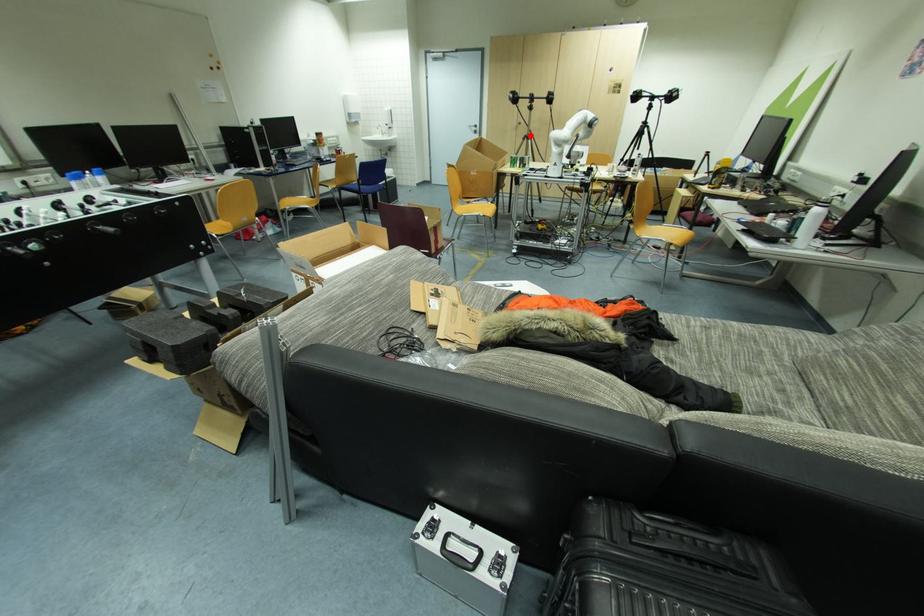
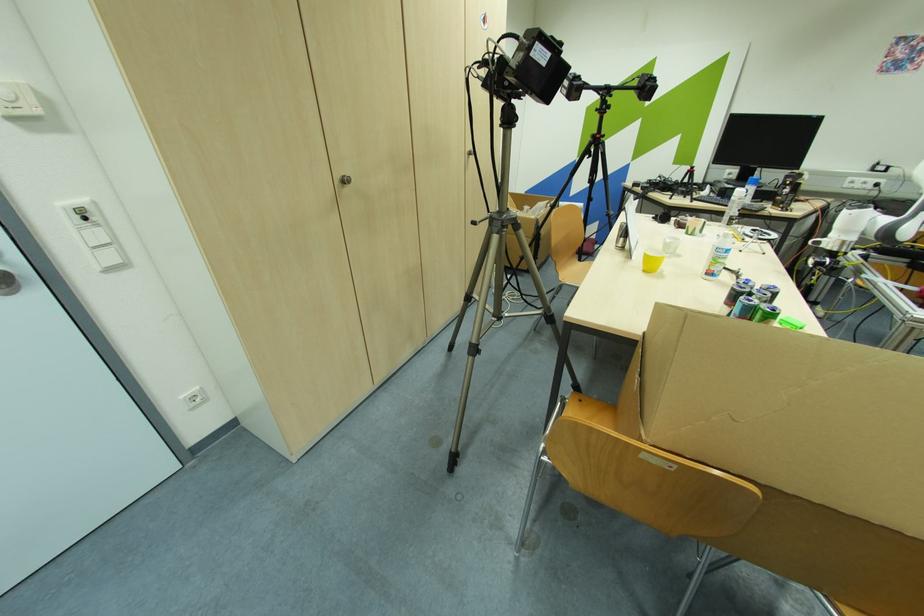
The point at the highlighted location is marked in the first image. Where is the corresponding point in the second image?

(504, 214)